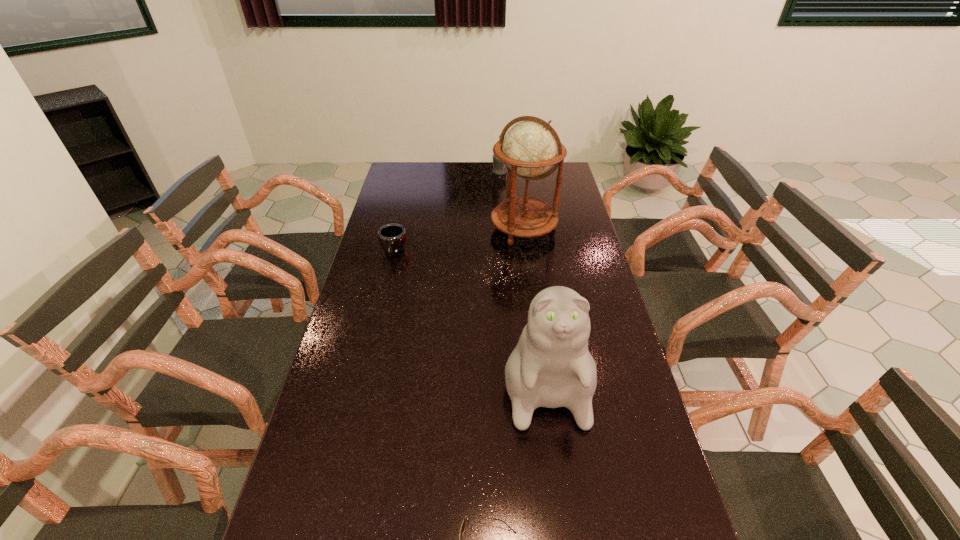
Identify the location of unoccupied area between the cat and the third tallest object. Image resolution: width=960 pixels, height=540 pixels. (522, 268).

Locate an element on the screen. The height and width of the screenshot is (540, 960). free space between the second tallest object and the third tallest object is located at coordinates (522, 268).

Identify the location of vacant region between the mug and the third shortest object. This screenshot has height=540, width=960. (446, 212).

Where is `vacant space that's between the second tallest object and the farthest object`? This screenshot has width=960, height=540. vacant space that's between the second tallest object and the farthest object is located at coordinates (522, 268).

I want to click on vacant space that's between the tallest object and the mug, so click(x=459, y=240).

This screenshot has width=960, height=540. In order to click on object that is the third closest one to the sunglasses in this screenshot , I will do `click(529, 149)`.

You are a GUI agent. You are given a task and a screenshot of the screen. Output one action in this format:
    pyautogui.click(x=<x>, y=<y>)
    Task: Click on the object that is the second closest one to the globe
    The image size is (960, 540).
    Given the screenshot: What is the action you would take?
    pyautogui.click(x=392, y=237)

Identify the location of vacant space that satisfies the following two spatial constraints: 1. on the front label of the vodka; 2. on the side of the second shortest object with the handle. This screenshot has width=960, height=540. (505, 252).